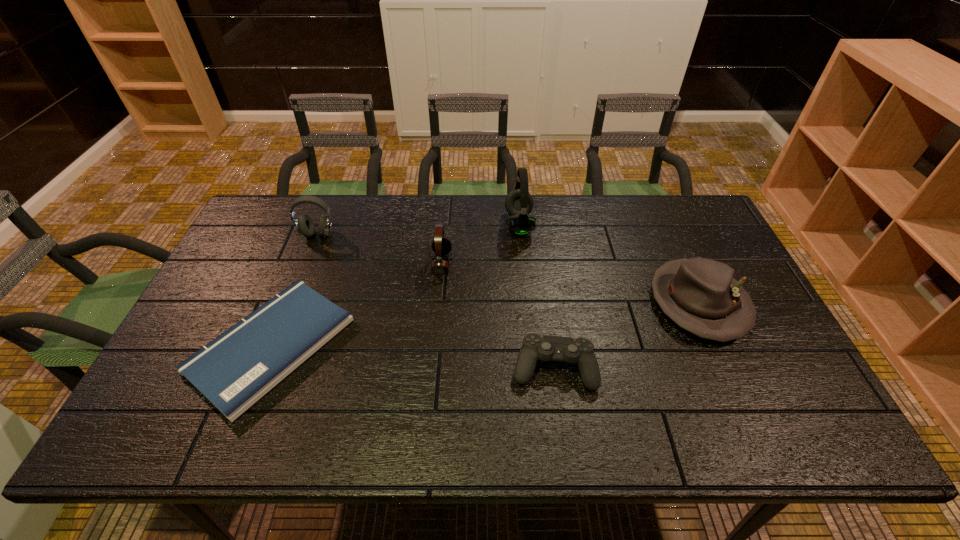
This screenshot has height=540, width=960. I want to click on the tallest headset, so click(x=519, y=203).

Locate an element on the screen. This screenshot has height=540, width=960. the tallest object is located at coordinates (519, 203).

Where is `the leftmost headset`? The height and width of the screenshot is (540, 960). the leftmost headset is located at coordinates (304, 225).

Where is `the second headset from right to left`? This screenshot has height=540, width=960. the second headset from right to left is located at coordinates (441, 245).

The height and width of the screenshot is (540, 960). I want to click on the third object from left to right, so click(x=441, y=245).

Where is `the fourth tallest object`? the fourth tallest object is located at coordinates (700, 295).

Find the location of a particular element. hat is located at coordinates (700, 295).

This screenshot has width=960, height=540. Find the location of `the second shortest object`. the second shortest object is located at coordinates (545, 348).

The height and width of the screenshot is (540, 960). I want to click on the shortest object, so click(x=236, y=369).

This screenshot has height=540, width=960. Find the location of `vacant space located on the ear cups of the rightmost headset`. vacant space located on the ear cups of the rightmost headset is located at coordinates (437, 225).